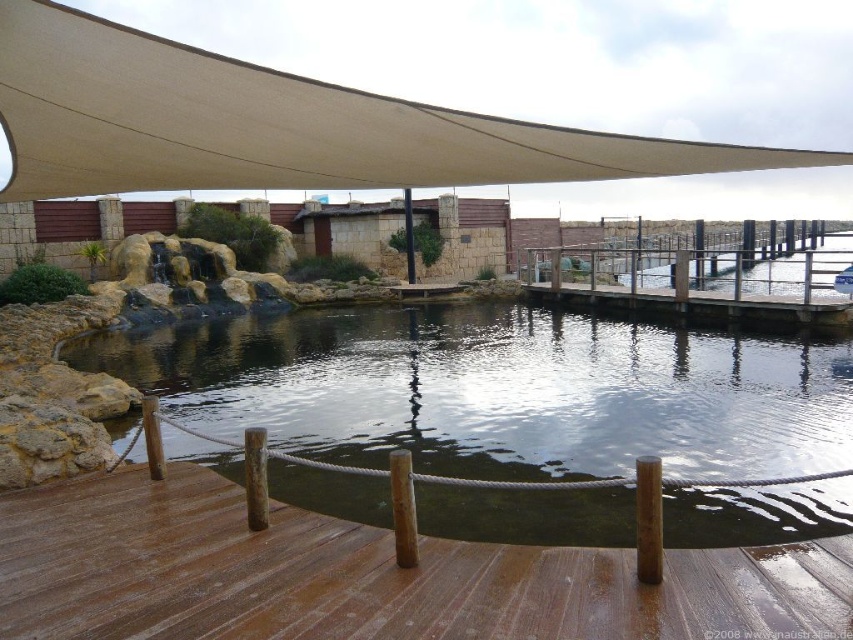
You are standing at the point marked by the coordinates point (368, 576). What is the name of the object located exactly at this point?

The point (368, 576) marks the brown wooden deck at center.

You are planning to set up a small picnic area in the park. You have a picnic blanket that can cover the brown wooden deck at center. Will the beige fabric canopy at upper center fit entirely under the blanket if you place it there?

The brown wooden deck at center occupies less space than the beige fabric canopy at upper center, so the beige fabric canopy at upper center will not fit entirely under the picnic blanket if placed there because it is larger than the deck.